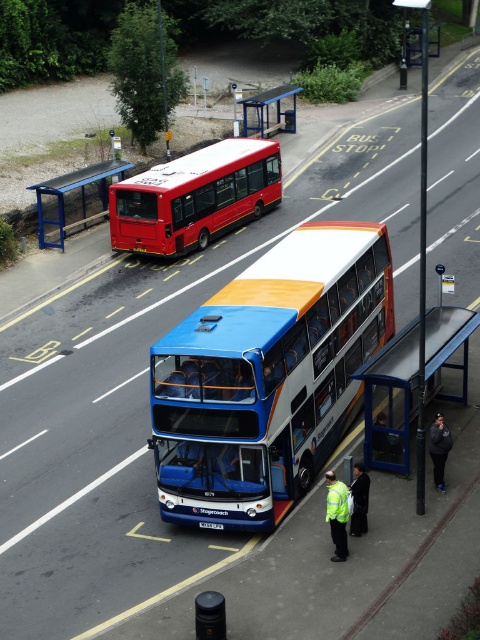
Does matte red bus at center have a greater height compared to blue plastic bus stop at lower right?

Yes.

Does point (257, 196) lie in front of point (411, 368)?

No, (257, 196) is further to viewer.

The width and height of the screenshot is (480, 640). Describe the element at coordinates (194, 196) in the screenshot. I see `matte red bus at center` at that location.

Identify the location of matte red bus at center. Image resolution: width=480 pixels, height=640 pixels. (194, 196).

Can you confirm if blue plastic bus stop at lower right is positioned below blue metal bus stop at upper left?

Yes.

Looking at this image, how far apart are blue plastic bus stop at lower right and blue metal bus stop at upper left?

63.84 feet

Is point (431, 372) closer to camera compared to point (38, 195)?

Yes.

You are a GUI agent. You are given a task and a screenshot of the screen. Output one action in this format:
    pyautogui.click(x=<x>, y=<y>)
    Task: Click on the blue plastic bus stop at lower right
    
    Given the screenshot: What is the action you would take?
    pyautogui.click(x=391, y=401)

Measure the distance between point (296,400) and camera.

The distance of point (296,400) from camera is 16.55 meters.

Is point (314, 280) positioned after point (391, 467)?

Yes, it is behind point (391, 467).

Does point (260, 404) come farther from viewer compared to point (439, 317)?

No, it is in front of (439, 317).

Locate an element on the screen. This screenshot has height=640, width=480. blue metallic decker bus at center is located at coordinates (267, 376).